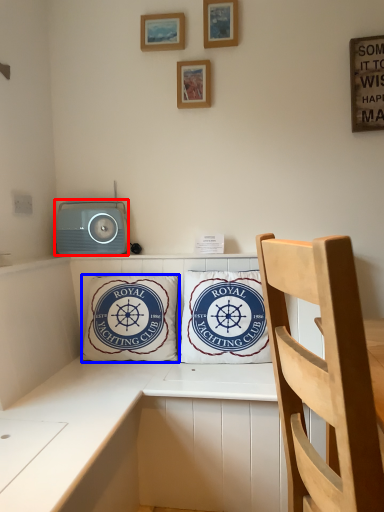
Question: Which of the following is the farthest to the observer, stereo (highlighted by a red box) or pillow (highlighted by a blue box)?

Choices:
 (A) stereo
 (B) pillow

Answer: (A)